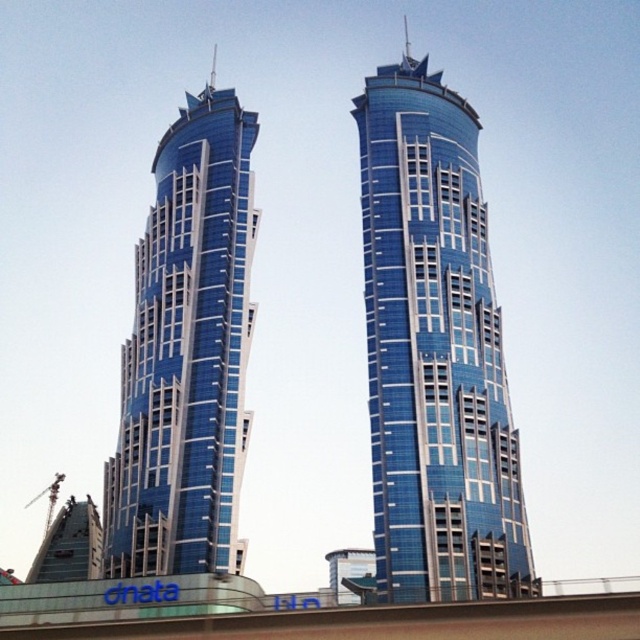
You are an architect reviewing a cityscape design. You notice two central structures labeled as the glossy glass tower at center and the blue glass building at center. Based on their positions in the scene, which one do you think is taller?

The glossy glass tower at center is located above the blue glass building at center, indicating it is taller.

From the picture: You are standing in front of two skyscrapers in the image. You want to take a photo of the glossy glass tower at center and the blue glass building at center. Which one should you focus on first to ensure it appears sharp in your photo?

You should focus on the glossy glass tower at center first because it is closer to you than the blue glass building at center, so capturing it sharply will ensure proper focus.